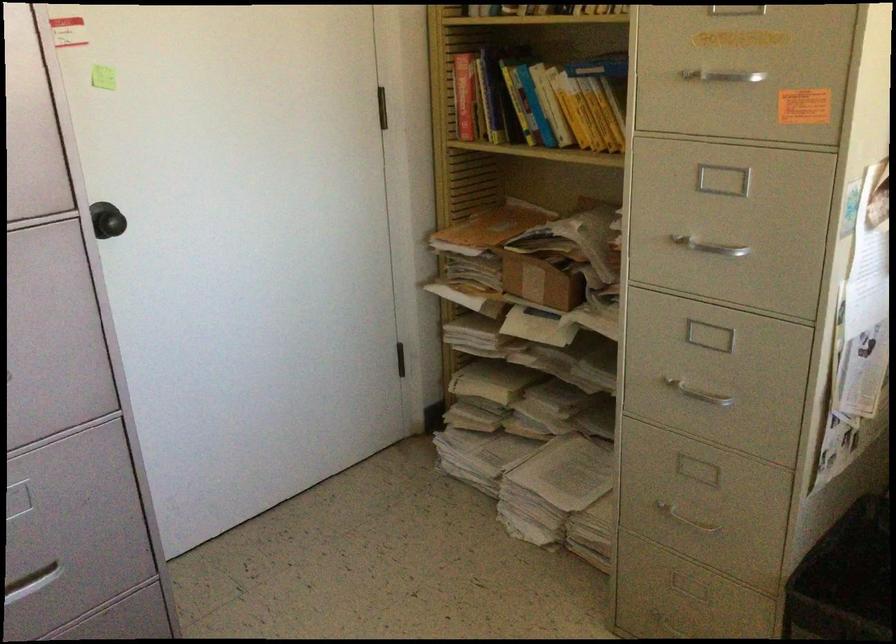
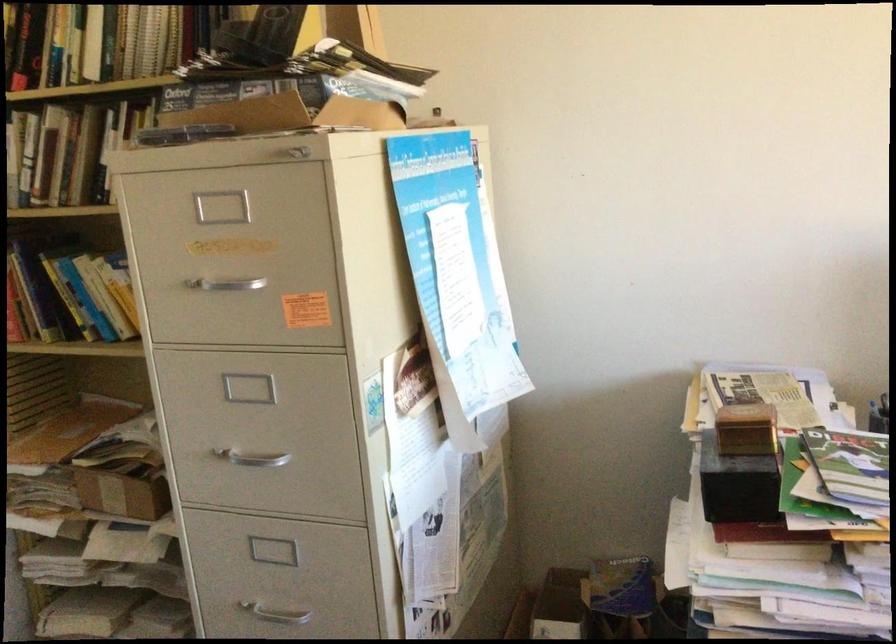
Question: Which direction would the cameraman need to move to produce the second image? Reply with the corresponding letter.

Choices:
 (A) Left
 (B) Right
 (C) Forward
 (D) Backward

Answer: (B)